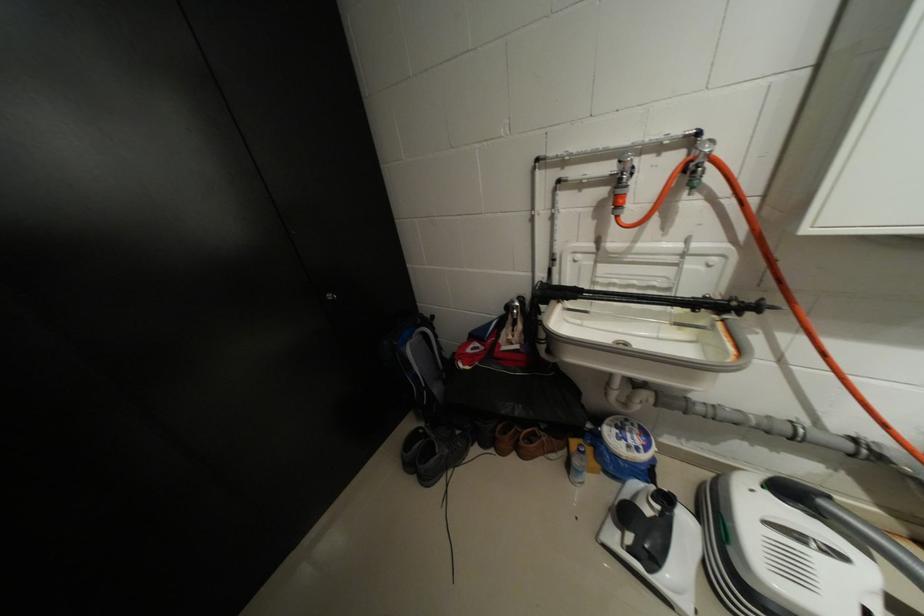
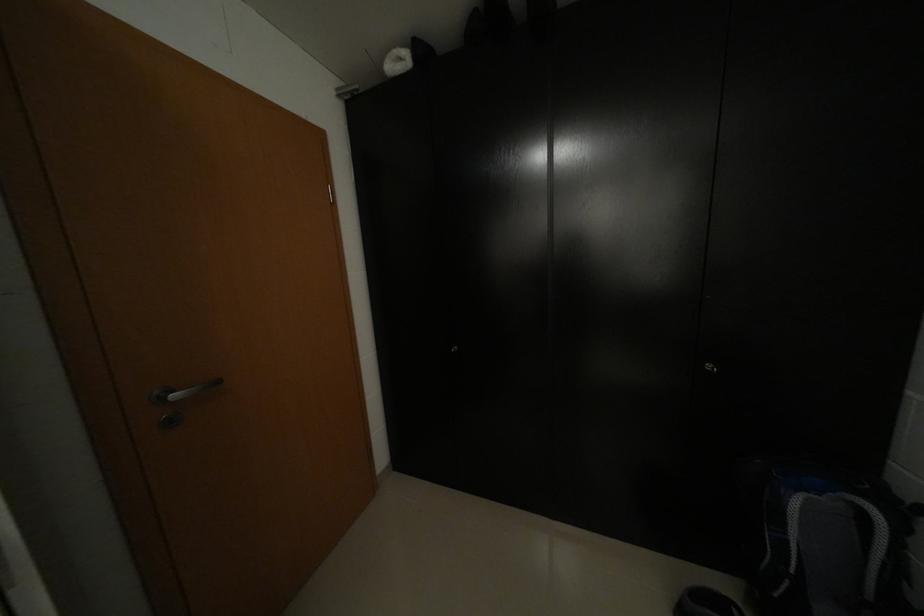
Question: The camera is either moving clockwise (left) or counter-clockwise (right) around the object. The first image is from the beginning of the video and the second image is from the end. Is the camera moving left or right when shooting the video?

Choices:
 (A) Left
 (B) Right

Answer: (B)